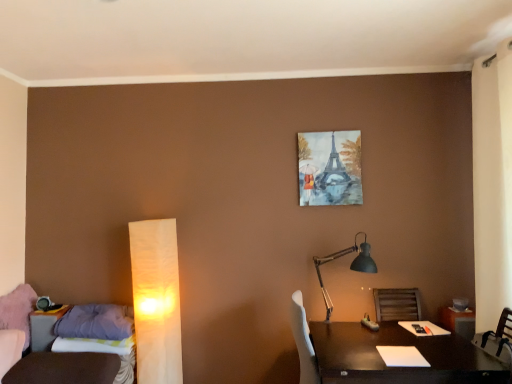
Question: Would you say watercolor painting of eiffel tower at upper center is inside or outside purple fabric pillow at lower left?

Choices:
 (A) outside
 (B) inside

Answer: (A)

Question: Is watercolor painting of eiffel tower at upper center taller or shorter than purple fabric pillow at lower left?

Choices:
 (A) tall
 (B) short

Answer: (A)

Question: Which of these objects is positioned farthest from the purple fabric pillow at lower left?

Choices:
 (A) watercolor painting of eiffel tower at upper center
 (B) matte black lamp at right, marked as the second lamp in a left-to-right arrangement
 (C) white paper lamp at left, positioned as the 2th lamp in right-to-left order
 (D) dark wood table at lower right
 (E) soft purple fabric at left

Answer: (A)

Question: Estimate the real-world distances between objects in this image. Which object is closer to the watercolor painting of eiffel tower at upper center?

Choices:
 (A) white paper lamp at left, arranged as the first lamp when viewed from the left
 (B) matte black lamp at right, marked as the second lamp in a left-to-right arrangement
 (C) soft purple fabric at left
 (D) dark wood table at lower right
 (E) purple fabric pillow at lower left

Answer: (B)